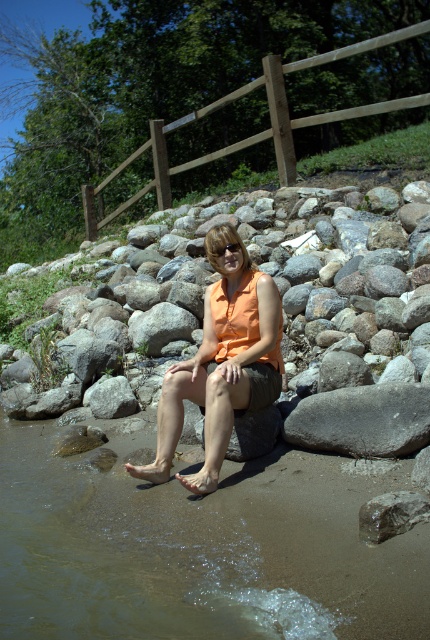
Does smooth gray rock at lower right lie behind transparent plastic goggles at center?

No, smooth gray rock at lower right is closer to the viewer.

Between smooth gray rock at lower right and transparent plastic goggles at center, which one is positioned higher?

transparent plastic goggles at center is above.

Which is behind, point (405, 529) or point (215, 257)?

Point (215, 257)

At what (x,y) coordinates should I click in order to perform the action: click on smooth gray rock at lower right. Please return your answer as a coordinate pair (x, y). This screenshot has width=430, height=640. Looking at the image, I should click on (390, 515).

Can you confirm if gray smooth rock at lower right is positioned below smooth gray rock at lower right?

No, gray smooth rock at lower right is not below smooth gray rock at lower right.

Identify the location of gray smooth rock at lower right. (362, 419).

Between point (415, 435) and point (218, 256), which one is positioned in front?

Point (415, 435)

Can you confirm if gray smooth rock at lower right is positioned to the left of transparent plastic goggles at center?

Incorrect, gray smooth rock at lower right is not on the left side of transparent plastic goggles at center.

Between point (300, 444) and point (218, 253), which one is positioned in front?

Point (300, 444) is more forward.

Identify the location of gray smooth rock at lower right. (362, 419).